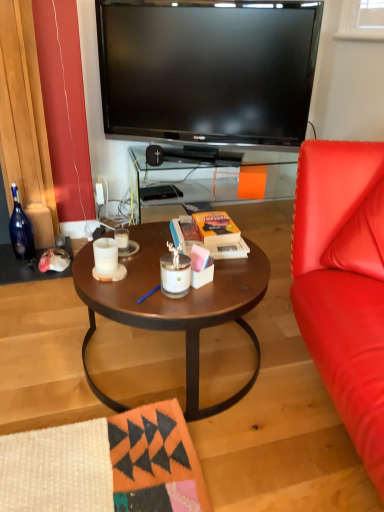
Identify the location of free space in front of white matte candle at center, the second coffee cup when ordered from front to back. (129, 268).